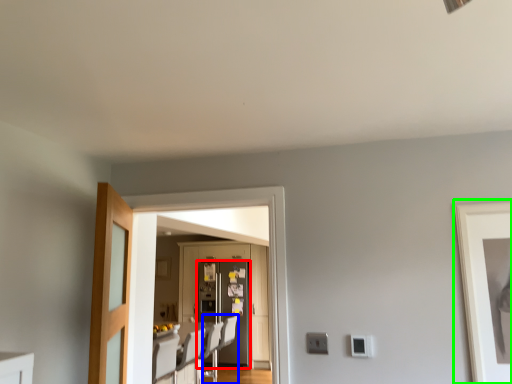
Question: Considering the real-world distances, which object is closest to refrigerator (highlighted by a red box)? swivel chair (highlighted by a blue box) or picture frame (highlighted by a green box).

Choices:
 (A) swivel chair
 (B) picture frame

Answer: (A)